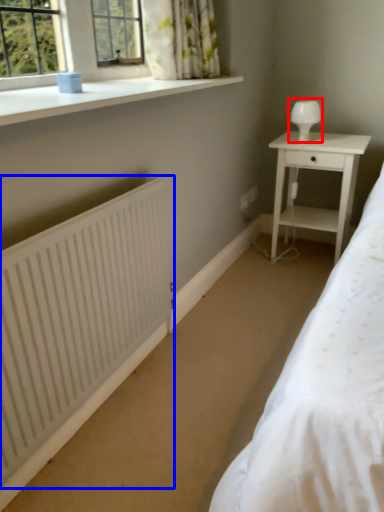
Question: Which of the following is the farthest to the observer, table lamp (highlighted by a red box) or radiator (highlighted by a blue box)?

Choices:
 (A) table lamp
 (B) radiator

Answer: (A)